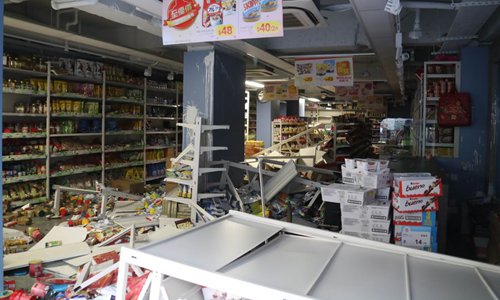
Identify the location of left side white wall. (5, 105).